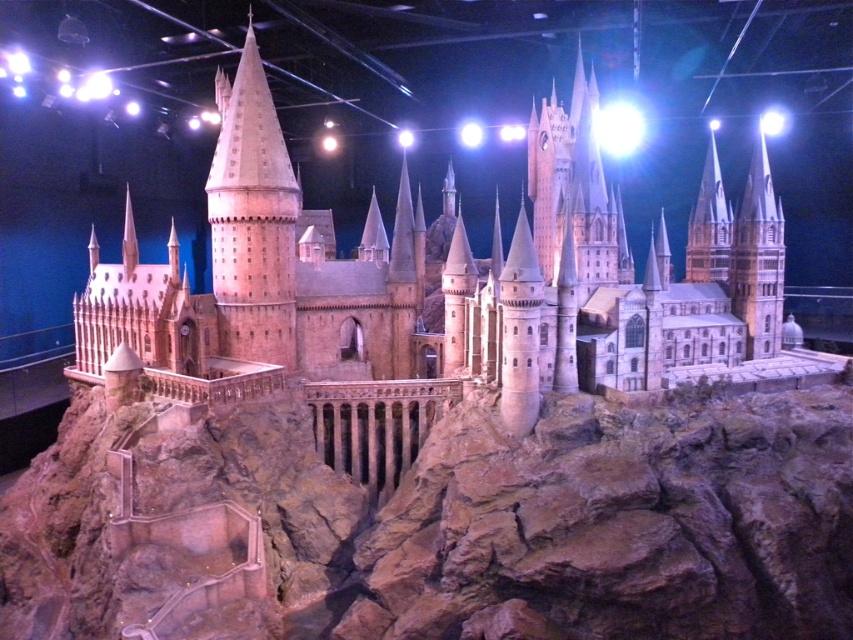
You are standing in front of the Hogwarts Castle model and notice two towers. One is the smooth beige stone tower at center and the other is the smooth stone tower at right. Which tower is positioned more to the left side of the model?

The smooth beige stone tower at center is positioned more to the left side of the model compared to the smooth stone tower at right.

You are a wizard standing at the entrance of the Hogwarts grounds. You see the matte brown castle at center. What is the exact coordinate of the castle in the image?

The matte brown castle at center is located at point (x=416, y=280).

You are a model maker who needs to place a new decorative flagpole on the tallest structure in the Hogwarts Castle model. Which object should you choose between the matte brown castle at center and the smooth stone tower at right?

The matte brown castle at center is much taller than the smooth stone tower at right, so you should place the flagpole on the matte brown castle at center.